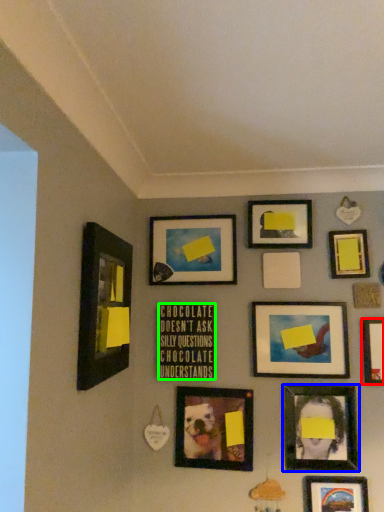
Question: Which object is positioned closest to picture frame (highlighted by a red box)? Select from picture frame (highlighted by a blue box) and picture frame (highlighted by a green box).

Choices:
 (A) picture frame
 (B) picture frame

Answer: (A)